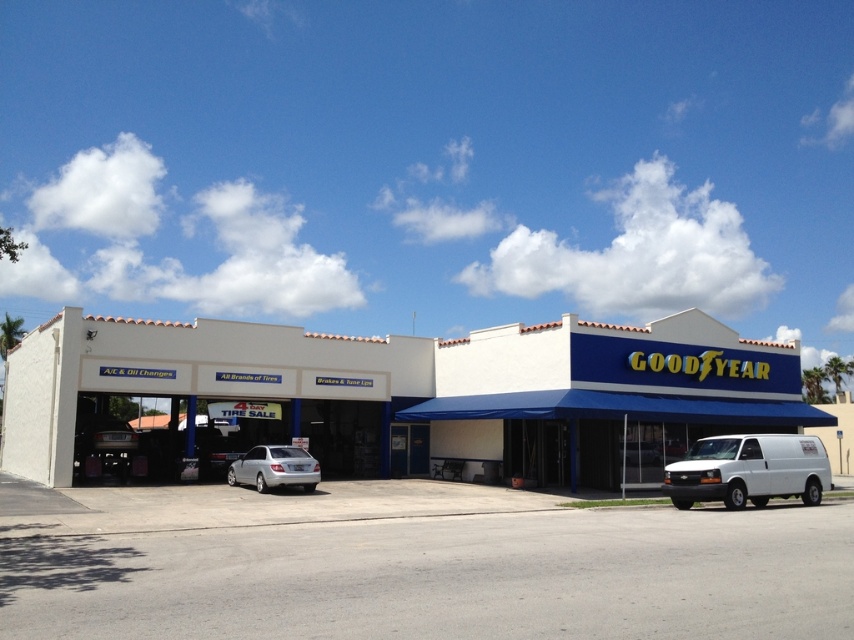
Based on the photo, you are a customer standing at the entrance of the Goodyear tire and automotive service center. You see a point marked at coordinates (747,470). Can you tell me what object this point is located on?

The point at coordinates (747,470) is located on the white matte van at lower right.

You are a customer trying to park your car in the parking lot next to the Goodyear service center. You see the white matte van at lower right and the silver metallic sedan at center. Which vehicle takes up less space in the parking spot?

The white matte van at lower right is thinner than the silver metallic sedan at center, so it takes up less space in the parking spot.

You are standing at the entrance of the Goodyear tire and automotive service center and want to take a photo of the white matte building at center and the white matte van at lower right. Which object should you focus on first if you want to capture both in a single frame without moving the camera?

You should focus on the white matte van at lower right first because the white matte building at center is taller than the van. By centering the van in the frame, you can adjust the camera angle to include the taller building without moving the camera position.